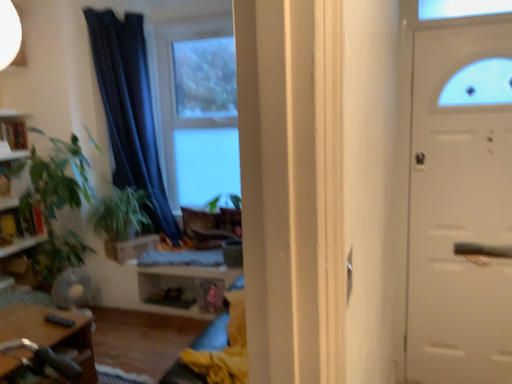
Question: Is wooden bookshelf at left spatially inside wooden table at lower left, or outside of it?

Choices:
 (A) outside
 (B) inside

Answer: (A)

Question: From the image's perspective, is wooden bookshelf at left above or below wooden table at lower left?

Choices:
 (A) below
 (B) above

Answer: (B)

Question: Which object is positioned farthest from the wooden table at lower left?

Choices:
 (A) wooden bookshelf at left
 (B) brown cardboard drawer at center
 (C) green leafy plant at left
 (D) dark blue fabric curtain at center
 (E) clear glass window at center

Answer: (E)

Question: Which object is positioned farthest from the dark blue fabric curtain at center?

Choices:
 (A) wooden bookshelf at left
 (B) clear glass window at center
 (C) green leafy plant at center
 (D) wooden table at lower left
 (E) brown cardboard drawer at center

Answer: (D)